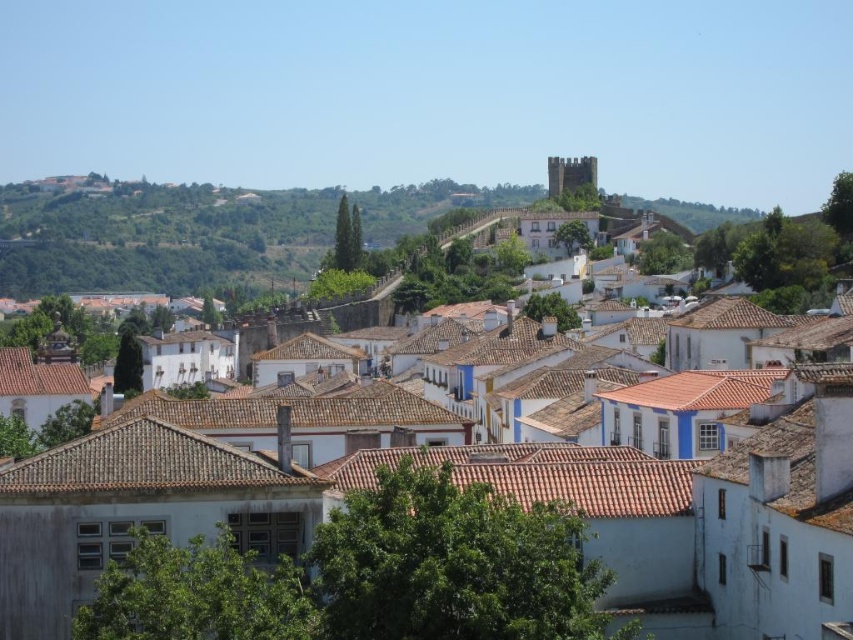
Question: Considering the relative positions of white tile roof at upper center and green grassy hillside at upper left in the image provided, where is white tile roof at upper center located with respect to green grassy hillside at upper left?

Choices:
 (A) below
 (B) above

Answer: (A)

Question: Can you confirm if white tile roof at upper center is thinner than green grassy hillside at upper left?

Choices:
 (A) no
 (B) yes

Answer: (B)

Question: Does white tile roof at upper center appear on the right side of green grassy hillside at upper left?

Choices:
 (A) no
 (B) yes

Answer: (B)